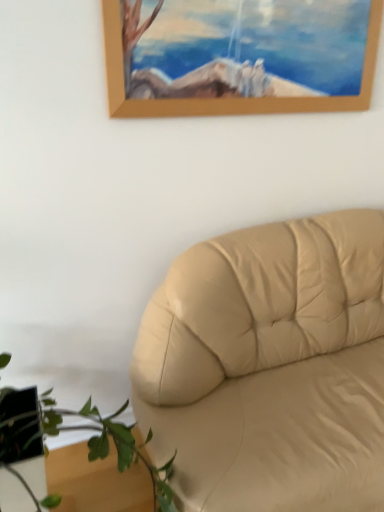
What is the approximate width of beige leather couch at lower right?

4.71 feet.

Find the location of `beige leather couch at lower right`. beige leather couch at lower right is located at coordinates (270, 367).

What do you see at coordinates (270, 367) in the screenshot? This screenshot has height=512, width=384. I see `beige leather couch at lower right` at bounding box center [270, 367].

This screenshot has width=384, height=512. I want to click on beige leather couch at lower right, so click(x=270, y=367).